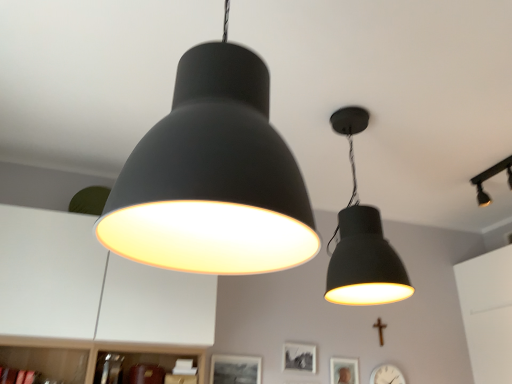
Question: Is white matte clock at lower right at the right side of matte black picture frame at center, the 2th picture frame in the right-to-left sequence?

Choices:
 (A) yes
 (B) no

Answer: (A)

Question: Are white matte clock at lower right and matte black picture frame at center, the 2th picture frame in the right-to-left sequence, far apart?

Choices:
 (A) yes
 (B) no

Answer: (B)

Question: Would you say matte black picture frame at center, which is counted as the 2th picture frame, starting from the left, is part of white matte clock at lower right's contents?

Choices:
 (A) yes
 (B) no

Answer: (B)

Question: From a real-world perspective, is white matte clock at lower right physically below matte black picture frame at center, the 2th picture frame in the right-to-left sequence?

Choices:
 (A) no
 (B) yes

Answer: (B)

Question: Considering the relative sizes of white matte clock at lower right and matte black picture frame at center, which is counted as the 2th picture frame, starting from the left, in the image provided, is white matte clock at lower right wider than matte black picture frame at center, which is counted as the 2th picture frame, starting from the left,?

Choices:
 (A) no
 (B) yes

Answer: (B)

Question: Is white matte clock at lower right further to camera compared to matte black picture frame at center, which is counted as the 2th picture frame, starting from the left?

Choices:
 (A) no
 (B) yes

Answer: (B)

Question: Is gold metallic crucifix at lower right taller than matte black picture frame at center, the 2th picture frame in the right-to-left sequence?

Choices:
 (A) yes
 (B) no

Answer: (A)

Question: From a real-world perspective, is gold metallic crucifix at lower right under matte black picture frame at center, which is counted as the 2th picture frame, starting from the left?

Choices:
 (A) yes
 (B) no

Answer: (B)

Question: Is gold metallic crucifix at lower right shorter than matte black picture frame at center, the 2th picture frame in the right-to-left sequence?

Choices:
 (A) yes
 (B) no

Answer: (B)

Question: Is gold metallic crucifix at lower right positioned far away from matte black picture frame at center, the 2th picture frame in the right-to-left sequence?

Choices:
 (A) no
 (B) yes

Answer: (A)

Question: From a real-world perspective, is gold metallic crucifix at lower right located higher than matte black picture frame at center, the 2th picture frame in the right-to-left sequence?

Choices:
 (A) no
 (B) yes

Answer: (B)

Question: Can you confirm if gold metallic crucifix at lower right is positioned to the right of matte black picture frame at center, the 2th picture frame in the right-to-left sequence?

Choices:
 (A) no
 (B) yes

Answer: (B)

Question: Can you confirm if gold metallic crucifix at lower right is positioned to the right of matte black picture frame at lower center, the 1th picture frame viewed from the left?

Choices:
 (A) yes
 (B) no

Answer: (A)